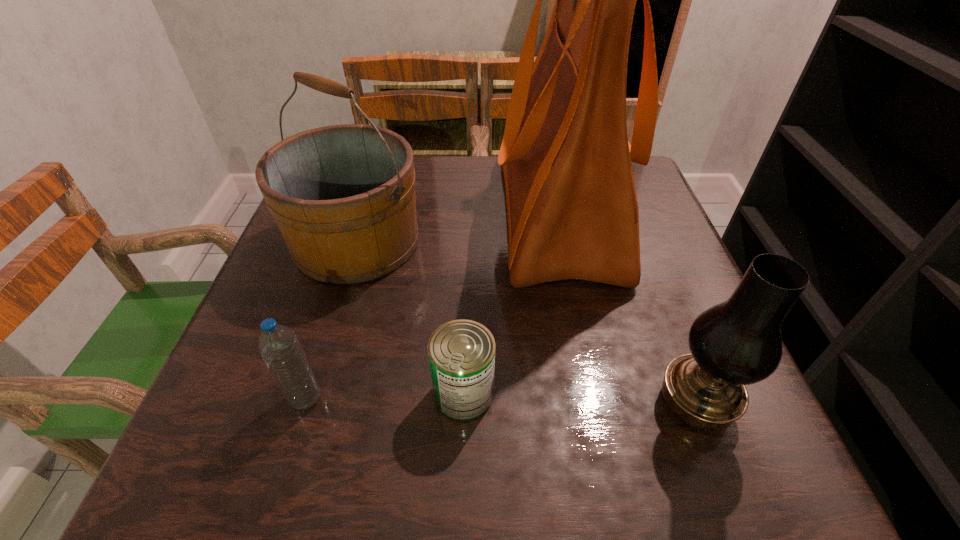
The width and height of the screenshot is (960, 540). Find the location of `the tallest object`. the tallest object is located at coordinates (572, 209).

Identify the location of bucket. (343, 196).

Image resolution: width=960 pixels, height=540 pixels. I want to click on the third shortest object, so click(738, 342).

What are the coordinates of `water bottle` in the screenshot? It's located at (278, 345).

At what (x,y) coordinates should I click in order to perform the action: click on the shortest object. Please return your answer as a coordinate pair (x, y). Looking at the image, I should click on (461, 352).

Locate an element on the screen. The height and width of the screenshot is (540, 960). can is located at coordinates (461, 352).

At what (x,y) coordinates should I click in order to perform the action: click on vacant region located 0.300m on the front pocket of the shopping bag. Please return your answer as a coordinate pair (x, y). This screenshot has height=540, width=960. Looking at the image, I should click on (368, 212).

Locate an element on the screen. The height and width of the screenshot is (540, 960). vacant space located 0.370m on the front pocket of the shopping bag is located at coordinates (338, 212).

Where is `vacant space located 0.180m on the front pocket of the shopping bag`? vacant space located 0.180m on the front pocket of the shopping bag is located at coordinates click(x=419, y=212).

Locate an element on the screen. This screenshot has width=960, height=540. free spot located 0.070m on the back of the second tallest object is located at coordinates (373, 187).